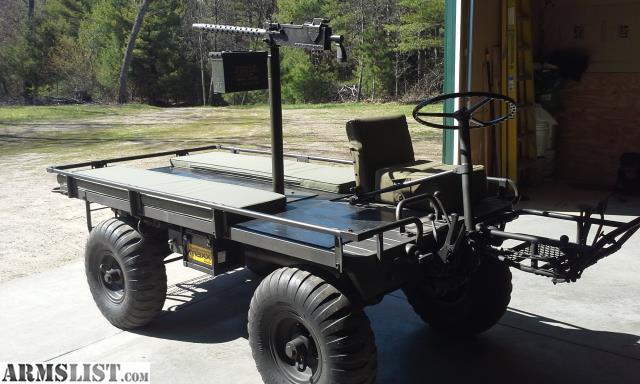
Where is `1 white bucket shown`? 1 white bucket shown is located at coordinates pyautogui.click(x=538, y=137).